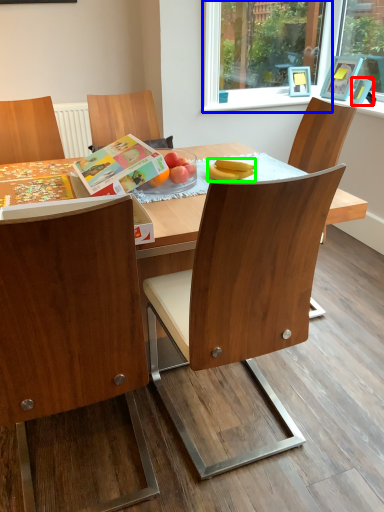
Question: Considering the real-world distances, which object is farthest from picture frame (highlighted by a red box)? window frame (highlighted by a blue box) or banana (highlighted by a green box)?

Choices:
 (A) window frame
 (B) banana

Answer: (B)